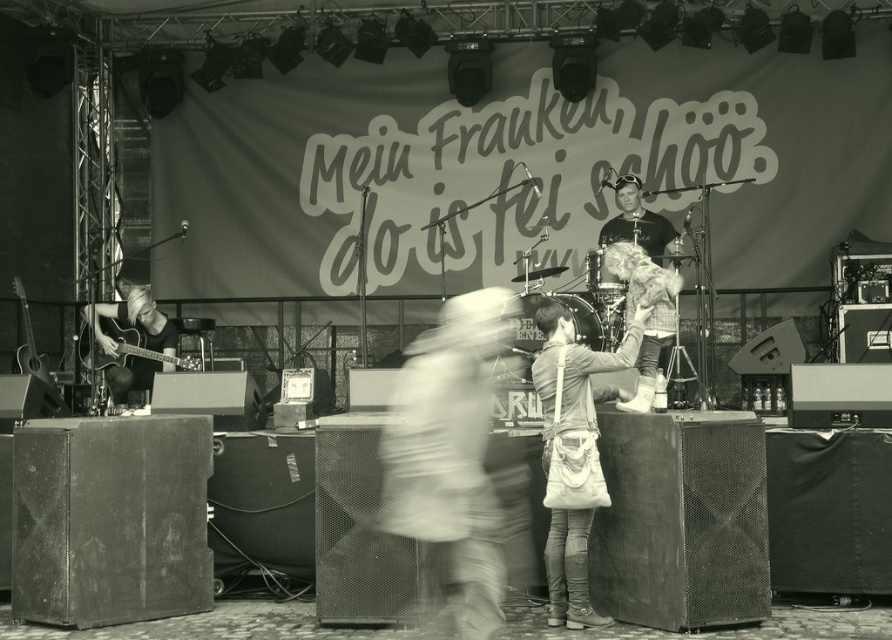
Question: Which object is farther from the camera taking this photo?

Choices:
 (A) matte black shirt at center
 (B) metallic silver guitar at left

Answer: (B)

Question: Considering the relative positions of smooth white shirt at center and matte black guitar at left in the image provided, where is smooth white shirt at center located with respect to matte black guitar at left?

Choices:
 (A) above
 (B) below

Answer: (B)

Question: Which object appears closest to the camera in this image?

Choices:
 (A) metallic silver guitar at left
 (B) matte black guitar at left

Answer: (A)

Question: Is matte black shirt at center to the right of metallic silver guitar at left from the viewer's perspective?

Choices:
 (A) yes
 (B) no

Answer: (A)

Question: Is smooth white shirt at center positioned at the back of leather jacket at center?

Choices:
 (A) no
 (B) yes

Answer: (A)

Question: Among these points, which one is nearest to the camera?

Choices:
 (A) (101, 369)
 (B) (469, 483)
 (C) (625, 342)

Answer: (B)